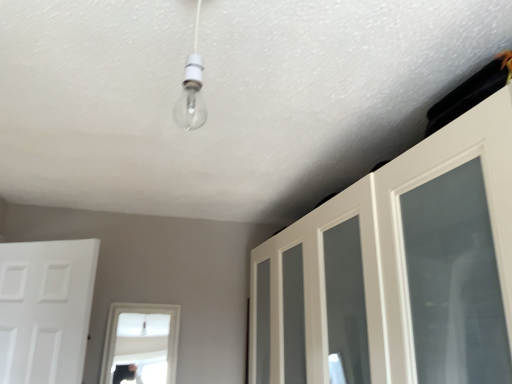
Question: Does white glossy cabinet at upper right, marked as the 2th door in a left-to-right arrangement, have a larger size compared to white matte door at left, the second door when ordered from right to left?

Choices:
 (A) no
 (B) yes

Answer: (B)

Question: Is white glossy cabinet at upper right, marked as the 2th door in a left-to-right arrangement, to the right of white matte door at left, the first door viewed from the left, from the viewer's perspective?

Choices:
 (A) no
 (B) yes

Answer: (B)

Question: Is white glossy cabinet at upper right, which appears as the 1th door when viewed from the right, completely or partially outside of white matte door at left, the first door viewed from the left?

Choices:
 (A) no
 (B) yes

Answer: (B)

Question: Does white glossy cabinet at upper right, which appears as the 1th door when viewed from the right, have a greater width compared to white matte door at left, the second door when ordered from right to left?

Choices:
 (A) yes
 (B) no

Answer: (A)

Question: From a real-world perspective, is white glossy cabinet at upper right, marked as the 2th door in a left-to-right arrangement, positioned under white matte door at left, the first door viewed from the left, based on gravity?

Choices:
 (A) no
 (B) yes

Answer: (A)

Question: Can you confirm if white glossy cabinet at upper right, which appears as the 1th door when viewed from the right, is shorter than white matte door at left, the second door when ordered from right to left?

Choices:
 (A) no
 (B) yes

Answer: (A)

Question: Is white matte door at left, the second door when ordered from right to left, not inside white glossy cabinet at upper right, which appears as the 1th door when viewed from the right?

Choices:
 (A) yes
 (B) no

Answer: (A)

Question: Can you see white matte door at left, the second door when ordered from right to left, touching white glossy cabinet at upper right, marked as the 2th door in a left-to-right arrangement?

Choices:
 (A) no
 (B) yes

Answer: (A)

Question: Is white matte door at left, the second door when ordered from right to left, smaller than white glossy cabinet at upper right, marked as the 2th door in a left-to-right arrangement?

Choices:
 (A) yes
 (B) no

Answer: (A)

Question: Does white matte door at left, the first door viewed from the left, lie in front of white glossy cabinet at upper right, which appears as the 1th door when viewed from the right?

Choices:
 (A) yes
 (B) no

Answer: (B)

Question: Is white matte door at left, the first door viewed from the left, at the right side of white glossy cabinet at upper right, which appears as the 1th door when viewed from the right?

Choices:
 (A) yes
 (B) no

Answer: (B)

Question: Is white matte door at left, the first door viewed from the left, facing towards white glossy cabinet at upper right, which appears as the 1th door when viewed from the right?

Choices:
 (A) no
 (B) yes

Answer: (A)

Question: Considering the positions of white matte door at left, the first door viewed from the left, and white glossy cabinet at upper right, which appears as the 1th door when viewed from the right, in the image, is white matte door at left, the first door viewed from the left, bigger or smaller than white glossy cabinet at upper right, which appears as the 1th door when viewed from the right,?

Choices:
 (A) big
 (B) small

Answer: (B)